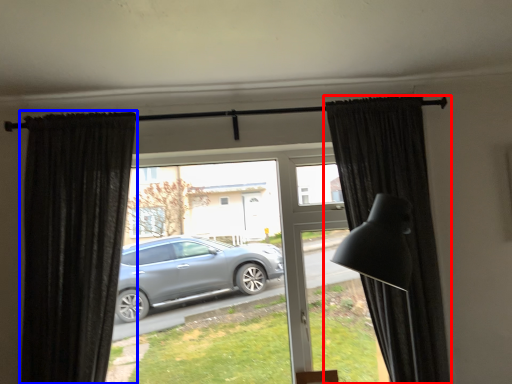
Question: Which point is further to the camera, curtain (highlighted by a red box) or curtain (highlighted by a blue box)?

Choices:
 (A) curtain
 (B) curtain

Answer: (B)